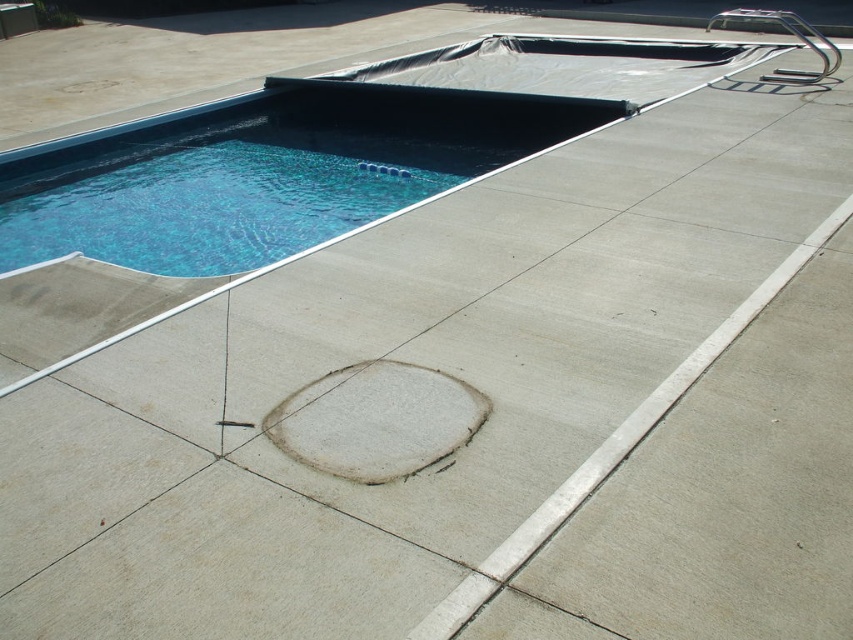
Where is `blue smooth pool at upper left`? The width and height of the screenshot is (853, 640). blue smooth pool at upper left is located at coordinates tap(268, 172).

Is blue smooth pool at upper left smaller than polished stainless steel ladder at upper right?

Yes.

Is point (285, 252) farther from viewer compared to point (834, 51)?

That is False.

The width and height of the screenshot is (853, 640). I want to click on blue smooth pool at upper left, so click(x=268, y=172).